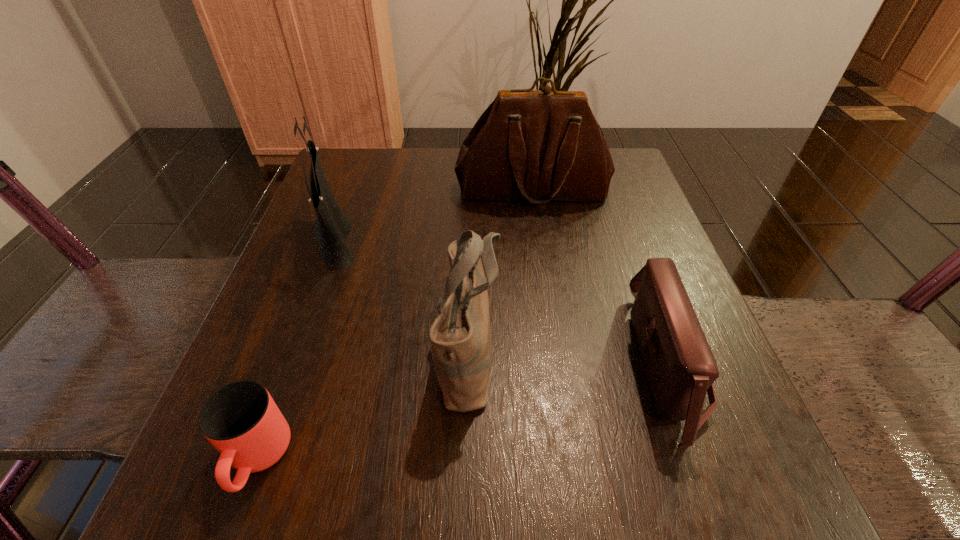
Where is `the leftmost shoulder bag`? the leftmost shoulder bag is located at coordinates (332, 227).

Image resolution: width=960 pixels, height=540 pixels. I want to click on the second shortest object, so click(x=680, y=366).

Where is `cup`? The image size is (960, 540). cup is located at coordinates (241, 420).

The width and height of the screenshot is (960, 540). I want to click on vacant position located on the back of the leftmost shoulder bag, so click(353, 185).

Locate an element on the screen. Image resolution: width=960 pixels, height=540 pixels. vacant space located 0.300m on the front flap of the shortest shoulder bag is located at coordinates (439, 364).

This screenshot has height=540, width=960. In order to click on free space located 0.220m on the front flap of the shortest shoulder bag in this screenshot , I will do `click(492, 364)`.

Find the location of `vacant region located 0.390m on the front flap of the shortest shoulder bag`. vacant region located 0.390m on the front flap of the shortest shoulder bag is located at coordinates [x=380, y=364].

Find the location of a particular element. object at the far edge is located at coordinates (540, 146).

Image resolution: width=960 pixels, height=540 pixels. I want to click on shoulder bag that is at the near edge, so click(680, 366).

I want to click on cup positioned at the near edge, so click(x=241, y=420).